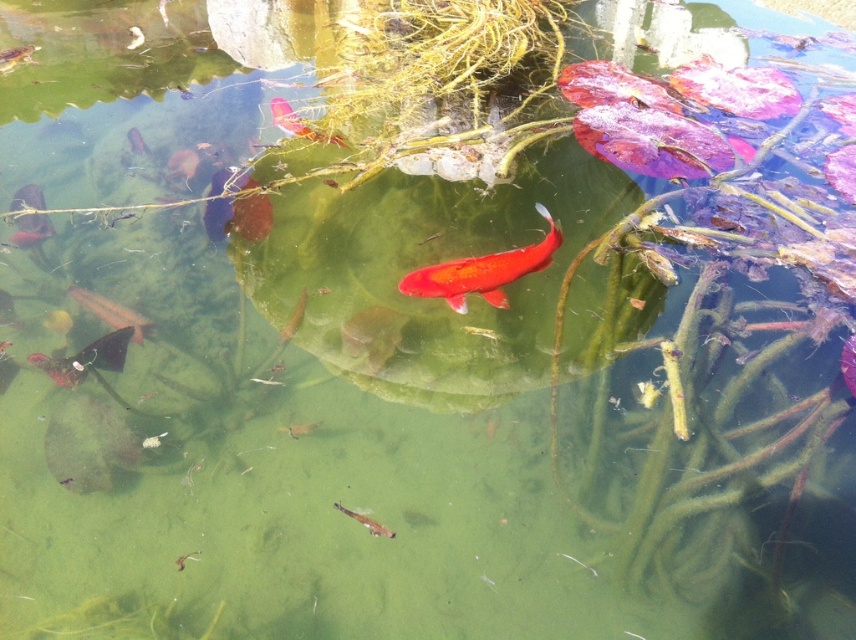
Who is positioned more to the right, shiny orange fish at center or shiny metallic fish at bottom left?

shiny orange fish at center

Is shiny orange fish at center smaller than shiny metallic fish at bottom left?

Incorrect, shiny orange fish at center is not smaller in size than shiny metallic fish at bottom left.

In the scene shown: Who is more distant from viewer, (479, 289) or (129, 316)?

The point (129, 316) is behind.

Find the location of a particular element. This screenshot has width=856, height=640. shiny orange fish at center is located at coordinates (482, 272).

What do you see at coordinates (482, 272) in the screenshot? This screenshot has width=856, height=640. I see `shiny orange fish at center` at bounding box center [482, 272].

Does point (551, 227) come in front of point (19, 243)?

That is True.

Is point (500, 305) closer to camera compared to point (22, 228)?

Yes, point (500, 305) is in front of point (22, 228).

The image size is (856, 640). I want to click on shiny orange fish at center, so pyautogui.click(x=482, y=272).

Does shiny metallic fish at lower left have a greater width compared to shiny orange fish at upper center?

In fact, shiny metallic fish at lower left might be narrower than shiny orange fish at upper center.

Is point (22, 221) less distant than point (324, 138)?

That is True.

Describe the element at coordinates (31, 228) in the screenshot. I see `shiny metallic fish at lower left` at that location.

This screenshot has width=856, height=640. What are the coordinates of `shiny metallic fish at lower left` in the screenshot? It's located at (31, 228).